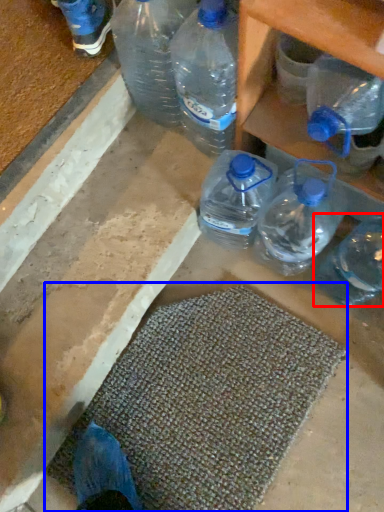
Question: Which object is closer to the camera taking this photo, bottle (highlighted by a red box) or bath mat (highlighted by a blue box)?

Choices:
 (A) bottle
 (B) bath mat

Answer: (A)